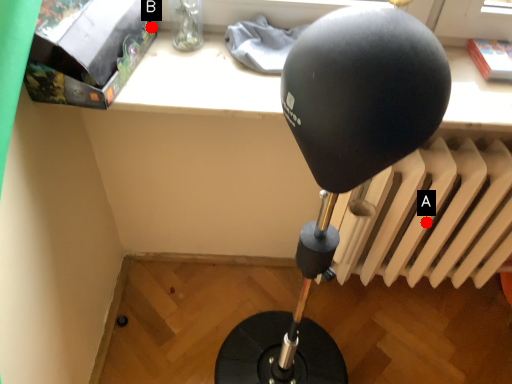
Question: Two points are circled on the image, labeled by A and B beside each circle. Which point is further to the camera?

Choices:
 (A) A is further
 (B) B is further

Answer: (A)